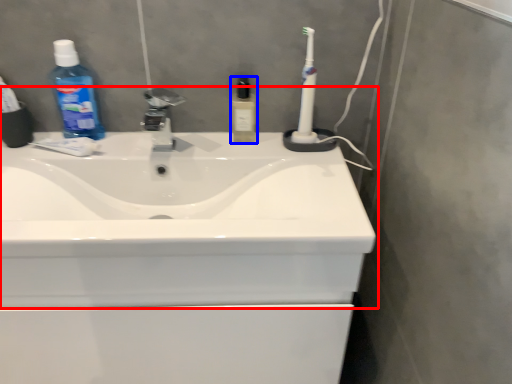
Question: Among these objects, which one is nearest to the camera, sink (highlighted by a red box) or toiletry (highlighted by a blue box)?

Choices:
 (A) sink
 (B) toiletry

Answer: (A)